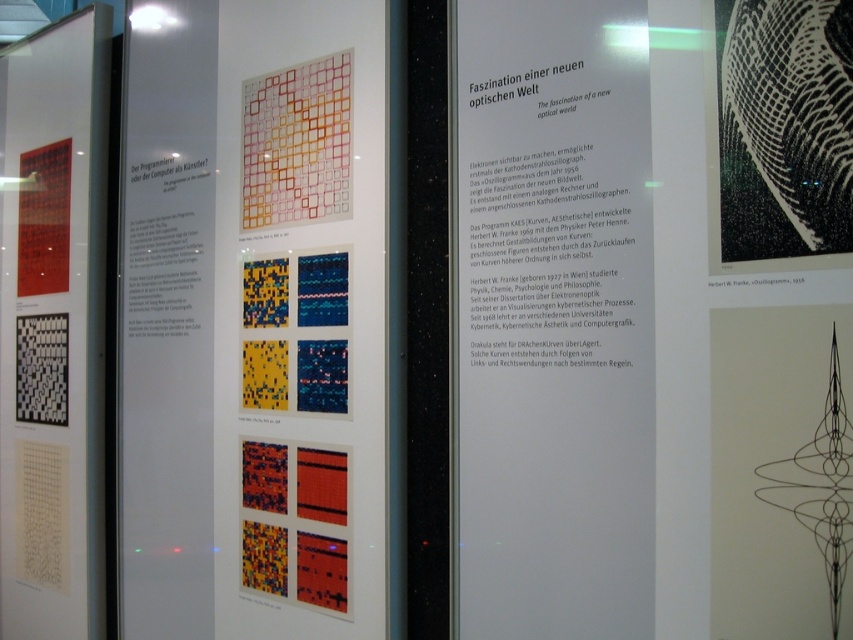
Question: Is white paper at center positioned before matte black poster at left?

Choices:
 (A) no
 (B) yes

Answer: (B)

Question: Which object is the closest to the white paper at center?

Choices:
 (A) matte paper poster at center
 (B) matte black poster at left
 (C) black line drawing at upper right

Answer: (C)

Question: Does matte paper poster at center have a lesser width compared to matte black poster at left?

Choices:
 (A) yes
 (B) no

Answer: (B)

Question: Which object is positioned farthest from the matte black poster at left?

Choices:
 (A) black line drawing at upper right
 (B) multicolored grid at center

Answer: (A)

Question: Can you confirm if matte paper poster at center is positioned below matte black poster at left?

Choices:
 (A) yes
 (B) no

Answer: (B)

Question: Which point is closer to the camera taking this photo?

Choices:
 (A) (38, 132)
 (B) (380, 257)
 (C) (733, 10)
 (D) (302, 144)

Answer: (C)